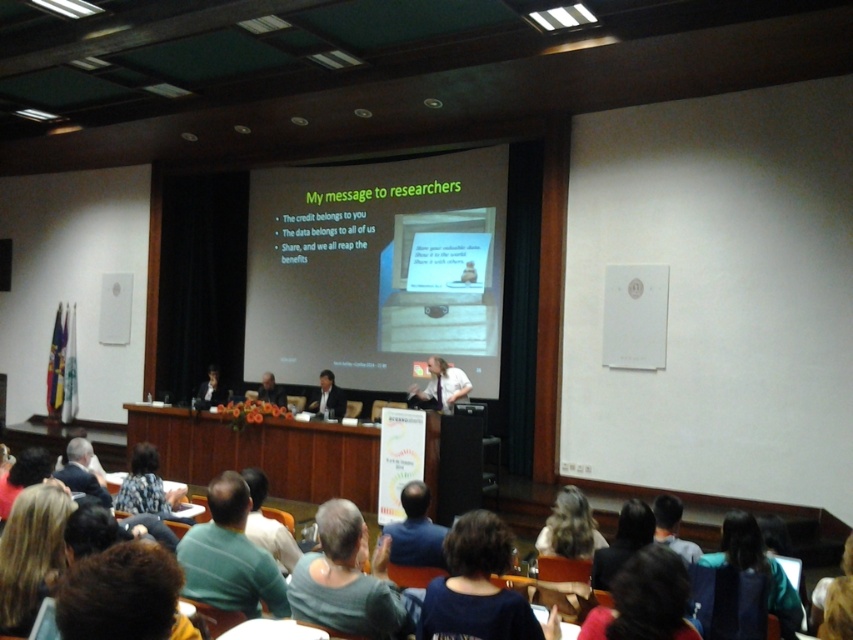
You are an attendee in the audience and want to describe the presenter to a colleague who can only see the back of the presenter. Which object is closer to the floor between the dark blue fabric at center and the white shirt at center?

The dark blue fabric at center is located below the white shirt at center, so the dark blue fabric at center is closer to the floor.

You are sitting in the audience and want to take a photo of the stage. You notice two points on the stage marked as point [509,593] and point [445,387]. Which point will appear larger in your photo?

Point [509,593] is closer to the camera than point [445,387], so it will appear larger in the photo.